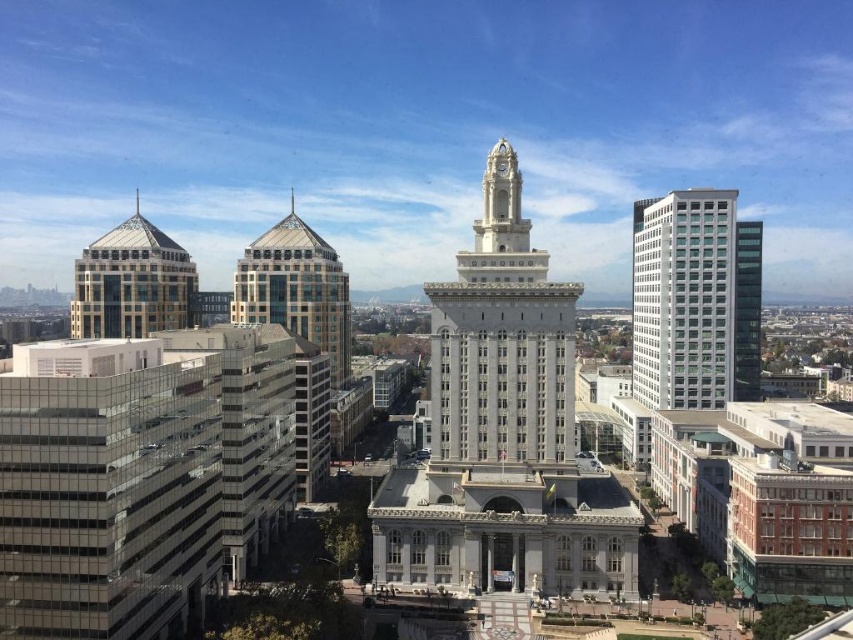
Who is shorter, white stone clock tower at center or white glass building at right?

white stone clock tower at center

Is point (509, 150) farther from camera compared to point (677, 378)?

No, it is in front of (677, 378).

You are a GUI agent. You are given a task and a screenshot of the screen. Output one action in this format:
    pyautogui.click(x=<x>, y=<y>)
    Task: Click on the white stone clock tower at center
    The width and height of the screenshot is (853, 640).
    Given the screenshot: What is the action you would take?
    pyautogui.click(x=502, y=339)

Looking at this image, can you confirm if white stone clock tower at center is shorter than glassy reflective skyscraper at center-left?

Correct, white stone clock tower at center is not as tall as glassy reflective skyscraper at center-left.

Who is more distant from viewer, (514, 266) or (303, 307)?

Point (303, 307)

Where is `white stone clock tower at center`? This screenshot has height=640, width=853. white stone clock tower at center is located at coordinates (502, 339).

Does white glass building at right appear over glassy reflective skyscraper at center-left?

Incorrect, white glass building at right is not positioned above glassy reflective skyscraper at center-left.

Is the position of white glass building at right more distant than that of glassy reflective skyscraper at center-left?

Yes, it is behind glassy reflective skyscraper at center-left.

Measure the distance between white glass building at right and camera.

A distance of 169.24 meters exists between white glass building at right and camera.

Identify the location of white glass building at right. The image size is (853, 640). (694, 300).